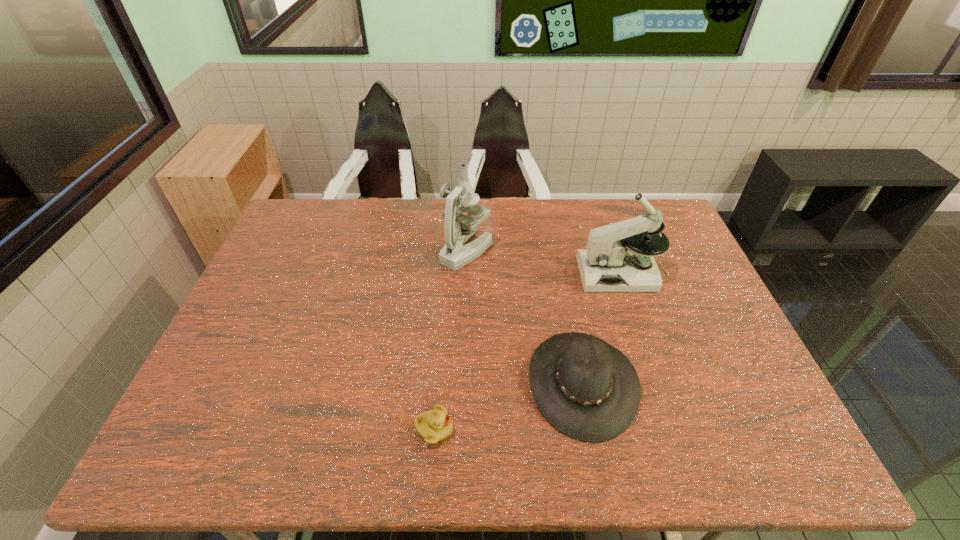
You are a GUI agent. You are given a task and a screenshot of the screen. Output one action in this format:
    pyautogui.click(x=<x>, y=<y>)
    Task: Click on the left microscope
    The height and width of the screenshot is (540, 960).
    Given the screenshot: What is the action you would take?
    pyautogui.click(x=458, y=228)

Locate an element on the screen. Image resolution: width=960 pixels, height=540 pixels. the right microscope is located at coordinates (607, 265).

You are a GUI agent. You are given a task and a screenshot of the screen. Output one action in this format:
    pyautogui.click(x=<x>, y=<y>)
    Task: Click on the second shortest object
    This screenshot has height=540, width=960.
    Given the screenshot: What is the action you would take?
    pyautogui.click(x=587, y=389)

Where is `duckling`? The image size is (960, 540). duckling is located at coordinates (435, 425).

Where is `blank space located on the front of the left microscope`? blank space located on the front of the left microscope is located at coordinates (464, 323).

Locate an element on the screen. vacant space situated 0.180m at the eyepiece of the right microscope is located at coordinates (522, 274).

Where is `free space located at the eyepiece of the right microscope`? Image resolution: width=960 pixels, height=540 pixels. free space located at the eyepiece of the right microscope is located at coordinates (525, 274).

The width and height of the screenshot is (960, 540). What are the coordinates of `vacant space located at the eyepiece of the right microscope` in the screenshot? It's located at (464, 274).

Image resolution: width=960 pixels, height=540 pixels. I want to click on vacant space located 0.280m on the front-facing side of the hat, so click(415, 383).

This screenshot has height=540, width=960. In order to click on free location located 0.120m on the front-facing side of the hat in this screenshot , I will do `click(480, 383)`.